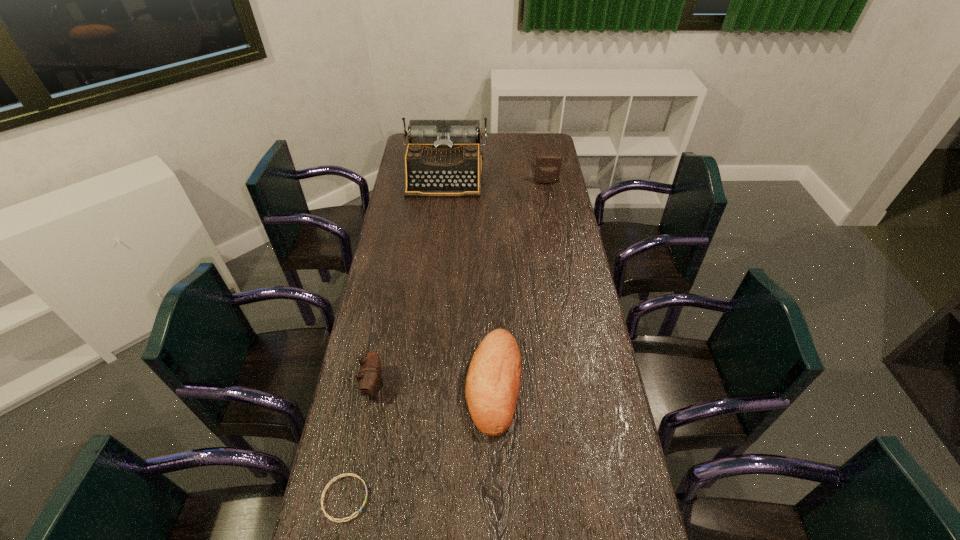
Where is `vacant area situated with the flap open on the shorter pouch`? Image resolution: width=960 pixels, height=540 pixels. vacant area situated with the flap open on the shorter pouch is located at coordinates (462, 386).

At what (x,y) coordinates should I click in order to perform the action: click on free space located on the left of the fourth tallest object. Please return your answer as a coordinate pair (x, y). Image resolution: width=960 pixels, height=540 pixels. Looking at the image, I should click on (357, 383).

At what (x,y) coordinates should I click in order to perform the action: click on blank area located on the surface of the nearest object showing star-shaped elements. Please return your answer as a coordinate pair (x, y). The width and height of the screenshot is (960, 540). Looking at the image, I should click on (441, 498).

Locate an element on the screen. Image resolution: width=960 pixels, height=540 pixels. object that is at the far edge is located at coordinates (443, 158).

At what (x,y) coordinates should I click in order to perform the action: click on typewriter situated at the left edge. Please return your answer as a coordinate pair (x, y). The height and width of the screenshot is (540, 960). Looking at the image, I should click on (443, 158).

Find the location of a particular element. This screenshot has height=540, width=960. pouch that is at the left edge is located at coordinates pyautogui.click(x=369, y=379).

Find the location of a particular element. bracelet present at the left edge is located at coordinates (348, 474).

You are a GUI agent. You are given a task and a screenshot of the screen. Output one action in this format:
    pyautogui.click(x=<x>, y=<y>)
    Task: Click on the object that is at the right edge
    The width and height of the screenshot is (960, 540).
    Given the screenshot: What is the action you would take?
    pyautogui.click(x=548, y=166)

You are a GUI agent. You are given a task and a screenshot of the screen. Output one action in this format:
    pyautogui.click(x=<x>, y=<y>)
    Task: Click on the object that is at the far left corner
    The width and height of the screenshot is (960, 540).
    Given the screenshot: What is the action you would take?
    pyautogui.click(x=443, y=158)

I want to click on vacant space at the far edge of the desktop, so click(x=511, y=148).